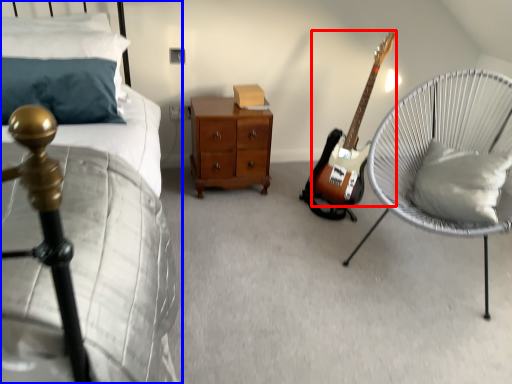
Question: Among these objects, which one is nearest to the camera, guitar (highlighted by a red box) or bed (highlighted by a blue box)?

Choices:
 (A) guitar
 (B) bed

Answer: (B)